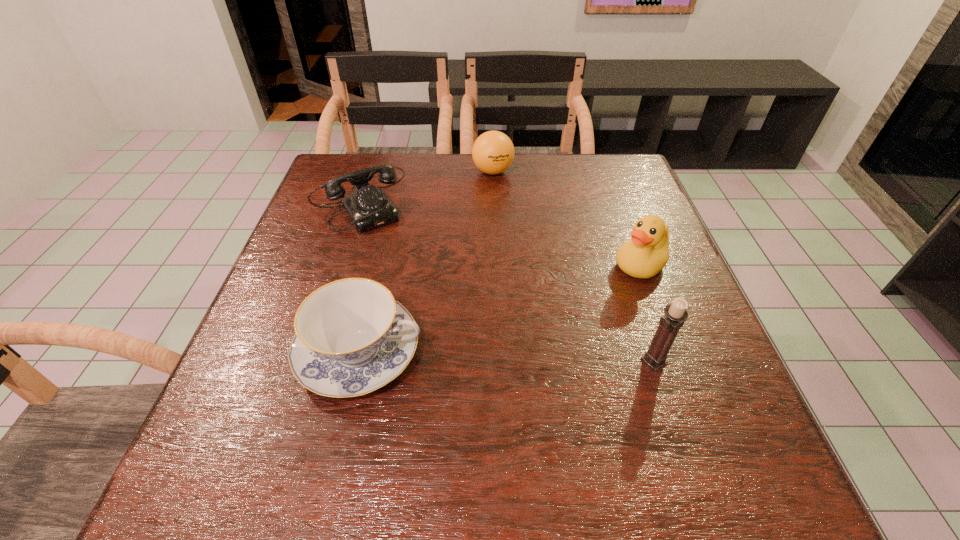
Locate an element on the screen. vacant space at the far left corner of the desktop is located at coordinates tap(336, 169).

In the image, there is a desktop. In order to click on vacant space at the far right corner in this screenshot , I will do `click(624, 192)`.

Locate an element on the screen. free space at the near right corner is located at coordinates (706, 415).

This screenshot has width=960, height=540. I want to click on free space between the chinaware and the third object from left to right, so click(426, 262).

The width and height of the screenshot is (960, 540). Identify the location of free area in between the duck and the ping-pong ball. (566, 219).

You are a GUI agent. You are given a task and a screenshot of the screen. Output one action in this format:
    pyautogui.click(x=<x>, y=<y>)
    Task: Click on the free spot between the chinaware and the ping-pong ball
    Image resolution: width=960 pixels, height=540 pixels.
    Given the screenshot: What is the action you would take?
    pyautogui.click(x=426, y=262)

At what (x,y) coordinates should I click in order to perform the action: click on empty space that is in between the chinaware and the candle holder. Please return your answer as a coordinate pair (x, y). Looking at the image, I should click on (507, 356).

This screenshot has height=540, width=960. I want to click on empty space that is in between the duck and the telephone, so click(502, 232).

The height and width of the screenshot is (540, 960). Find the location of `free space between the candle holder and the chinaware`. free space between the candle holder and the chinaware is located at coordinates (507, 356).

Locate an element on the screen. vacant area that lies between the candle holder and the ping-pong ball is located at coordinates (573, 266).